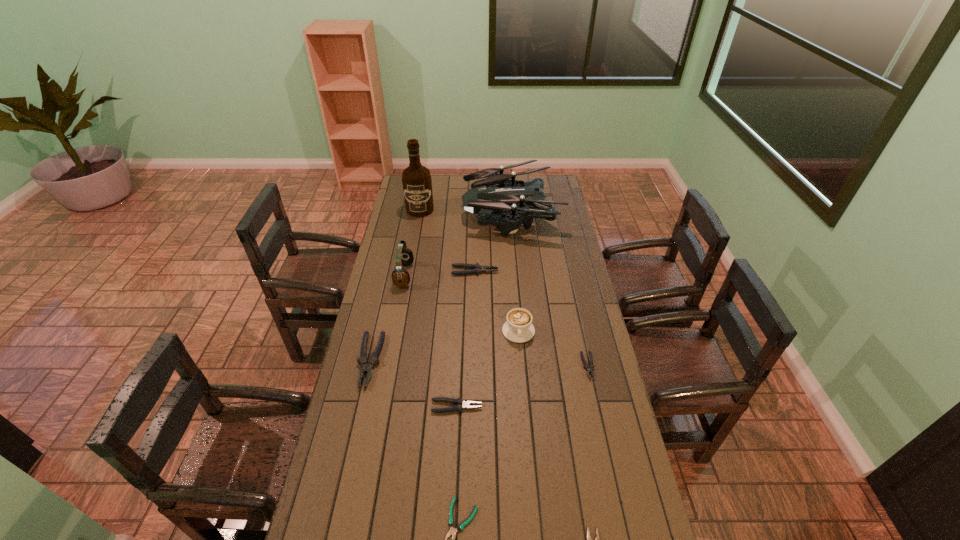
Identify the location of free region located at the gripping part of the third shortest object. The width and height of the screenshot is (960, 540). (598, 411).

Find the location of a particular element. Image resolution: width=960 pixels, height=540 pixels. object that is at the far edge is located at coordinates (492, 195).

You are a GUI agent. You are given a task and a screenshot of the screen. Output one action in this format:
    pyautogui.click(x=<x>, y=<y>)
    Task: Click on the alcohol that is positioned at the left edge
    
    Given the screenshot: What is the action you would take?
    pyautogui.click(x=417, y=184)

Find the location of `headset that is positioned at the left edge`. headset that is positioned at the left edge is located at coordinates (404, 256).

Locate an element on the screen. The height and width of the screenshot is (540, 960). pliers that is at the left edge is located at coordinates (366, 365).

You are a GUI agent. You are given a task and a screenshot of the screen. Output one action in this format:
    pyautogui.click(x=<x>, y=<y>)
    Task: Click on the drone at the right edge
    
    Given the screenshot: What is the action you would take?
    pyautogui.click(x=492, y=195)

Locate an element on the screen. Image resolution: width=960 pixels, height=540 pixels. pliers that is at the right edge is located at coordinates (589, 368).

Identify the location of object that is at the far right corner. (492, 195).

Locate an element on the screen. The image size is (960, 540). free space at the far edge is located at coordinates (449, 195).

Find the location of `free spot at the left edge of the desktop`. free spot at the left edge of the desktop is located at coordinates click(393, 354).